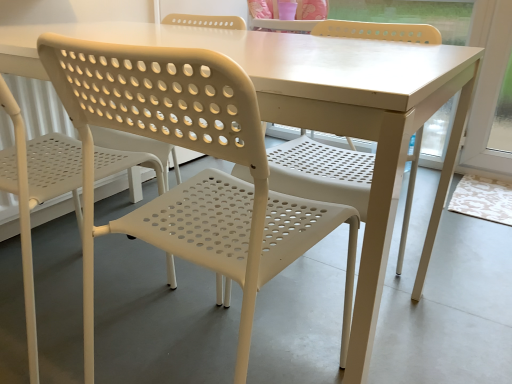
What are the coordinates of `vacant space in between white plastic chair at center, which appears as the first chair when viewed from the right, and white plastic chair at left, the 2th chair when ordered from right to left` in the screenshot? It's located at (154, 334).